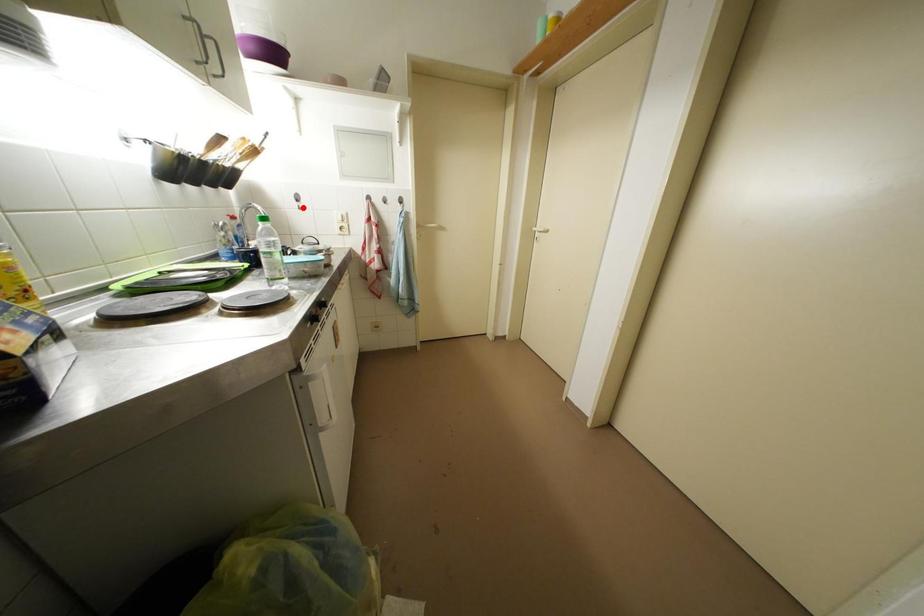
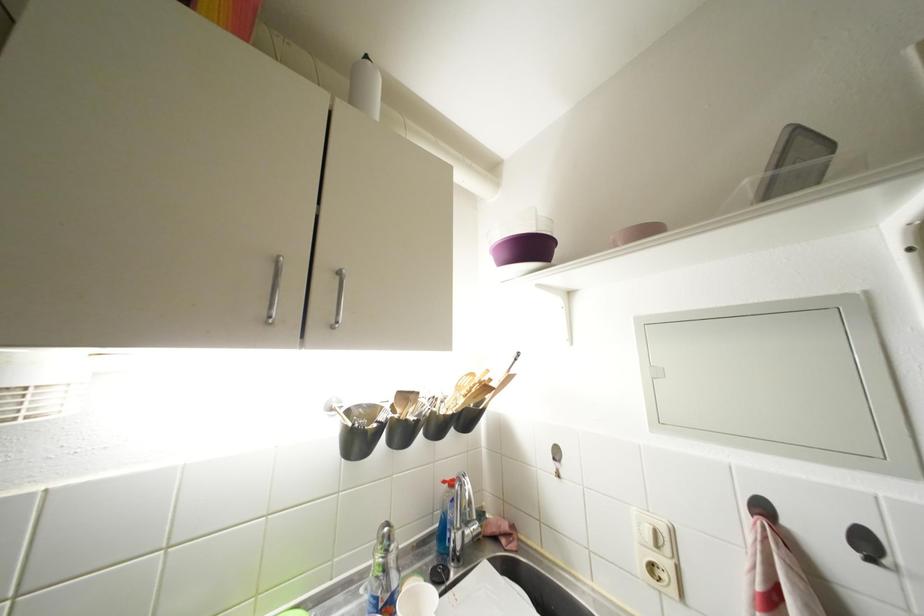
Question: I am providing you with two images of the same scene from different viewpoints. Image1 has a red point marked. In image2, the corresponding 3D location appears at what relative position? Reply with the corresponding letter.

Choices:
 (A) Closer
 (B) Farther

Answer: (B)